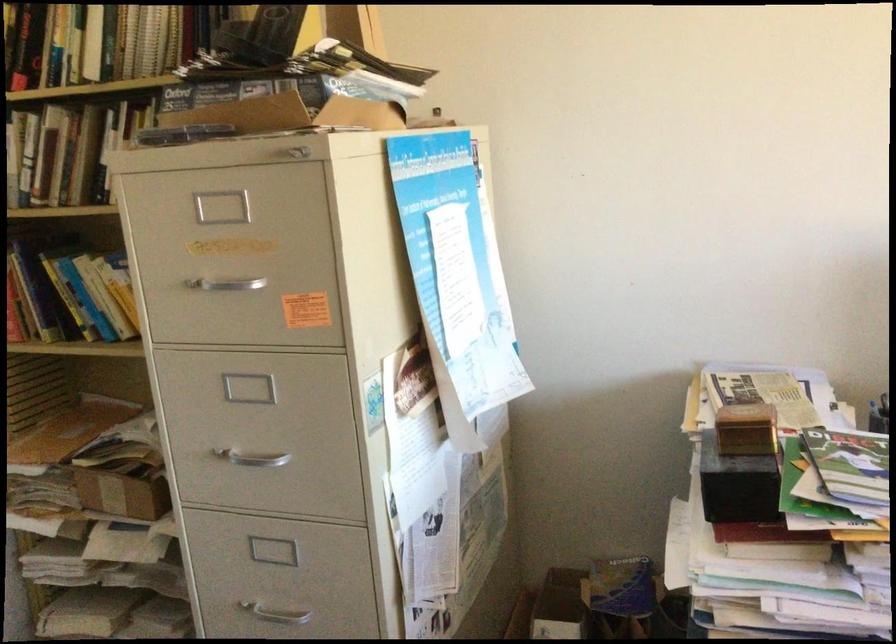
Image resolution: width=896 pixels, height=644 pixels. Find the location of `small cardboard box`. small cardboard box is located at coordinates pos(123,488).